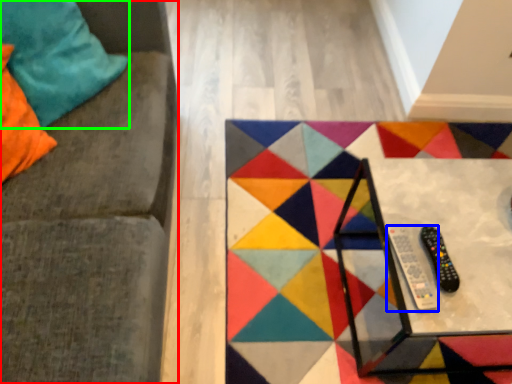
Question: Which object is the farthest from furniture (highlighted by a red box)? Choose among these: remote (highlighted by a blue box) or pillow (highlighted by a green box).

Choices:
 (A) remote
 (B) pillow

Answer: (A)